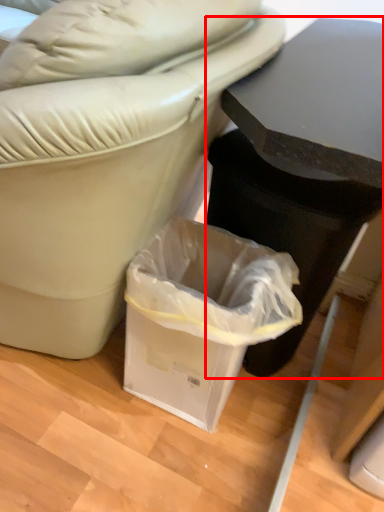
Question: From the image's perspective, where is table (annotated by the red box) located relative to waste container?

Choices:
 (A) below
 (B) above

Answer: (B)